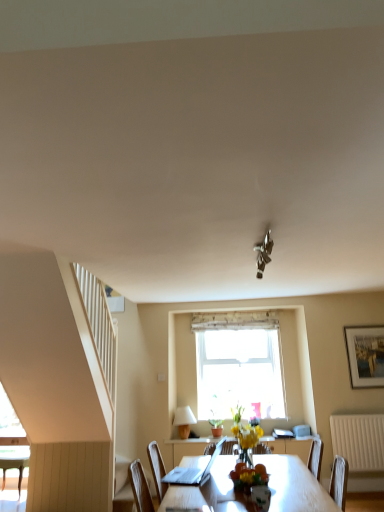
Question: From a real-world perspective, is wooden/textured curtain at upper center physically located above or below yellow matte vase at center?

Choices:
 (A) above
 (B) below

Answer: (A)

Question: Is wooden/textured curtain at upper center spatially inside yellow matte vase at center, or outside of it?

Choices:
 (A) outside
 (B) inside

Answer: (A)

Question: Which object is the farthest from the clear glass window at center?

Choices:
 (A) yellow matte vase at center
 (B) silver metallic picture frame at upper right
 (C) wooden/textured curtain at upper center
 (D) white textured radiator at lower right
 (E) white matte lampshade at lower center

Answer: (A)

Question: Estimate the real-world distances between objects in this image. Which object is farther from the wooden table at center?

Choices:
 (A) white matte lampshade at lower center
 (B) yellow matte vase at center
 (C) silver metallic picture frame at upper right
 (D) wooden/textured curtain at upper center
 (E) white textured radiator at lower right

Answer: (A)